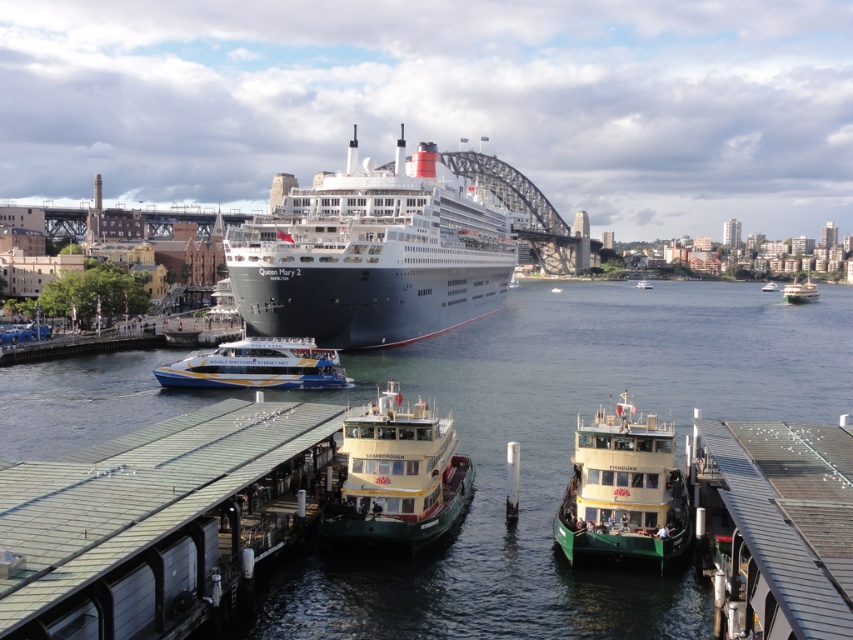
Question: Which point is farther from the camera taking this photo?

Choices:
 (A) [x=461, y=392]
 (B) [x=360, y=531]
 (C) [x=788, y=285]

Answer: (C)

Question: Can you confirm if blue and yellow painted ferry at center is positioned above white glossy ferry at center?

Choices:
 (A) yes
 (B) no

Answer: (B)

Question: Is green painted ferry at center below blue and yellow painted ferry at center?

Choices:
 (A) yes
 (B) no

Answer: (A)

Question: Among these objects, which one is farthest from the camera?

Choices:
 (A) metallic gray dock at lower right
 (B) yellow-green plastic boat at right

Answer: (B)

Question: Among these points, which one is nearest to the camera?

Choices:
 (A) (334, 184)
 (B) (799, 289)
 (C) (276, 368)
 (D) (643, 282)

Answer: (C)

Question: Can you confirm if green corrugated metal dock at lower center is positioned below white plastic boat at center?

Choices:
 (A) yes
 (B) no

Answer: (A)